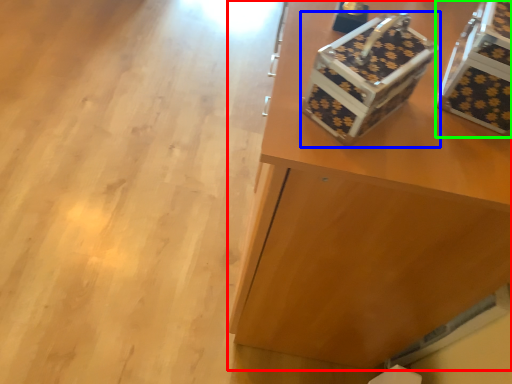
Question: Which is nearer to the furniture (highlighted by a red box)? shoe box (highlighted by a blue box) or storage box (highlighted by a green box).

Choices:
 (A) shoe box
 (B) storage box

Answer: (A)